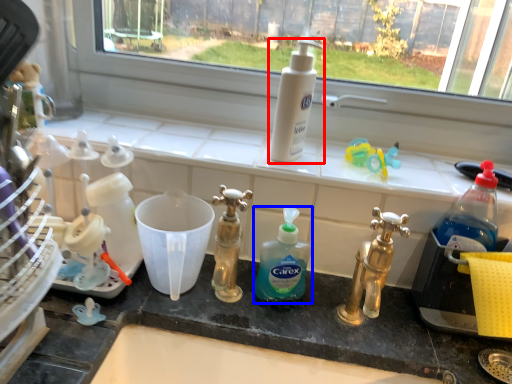
Question: Which of the following is the closest to the observer, cleaning product (highlighted by a red box) or cleaning product (highlighted by a blue box)?

Choices:
 (A) cleaning product
 (B) cleaning product

Answer: (B)